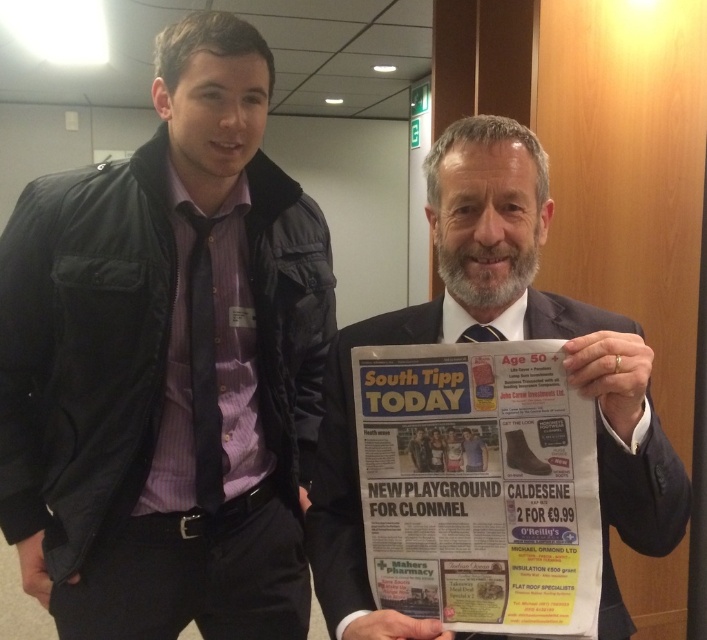
Question: Which of the following is the farthest from the observer?

Choices:
 (A) white paper newspaper at center
 (B) dark blue textured tie at center

Answer: (B)

Question: Is matte black jacket at left positioned behind dark gray suit at center?

Choices:
 (A) no
 (B) yes

Answer: (B)

Question: Which of the following is the closest to the observer?

Choices:
 (A) dark blue textured tie at center
 (B) dark blue textured tie at left
 (C) matte black jacket at left
 (D) dark gray suit at center

Answer: (D)

Question: Is white paper newspaper at center to the right of dark blue textured tie at center from the viewer's perspective?

Choices:
 (A) no
 (B) yes

Answer: (A)

Question: Is white paper newspaper at center wider than dark blue textured tie at center?

Choices:
 (A) yes
 (B) no

Answer: (A)

Question: Which point appears farthest from the camera in this image?

Choices:
 (A) (214, 332)
 (B) (228, 436)

Answer: (B)